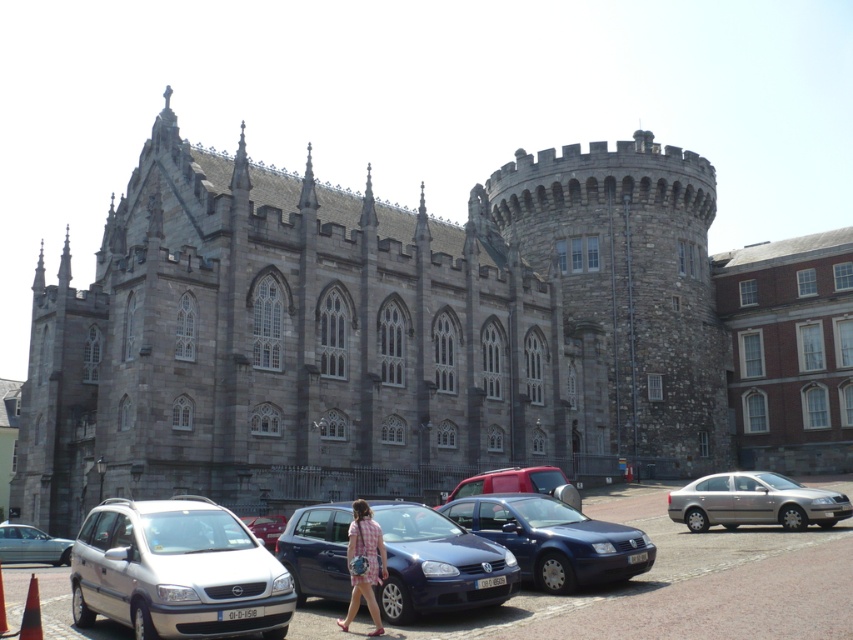
Question: Which point is closer to the camera?

Choices:
 (A) (44, 536)
 (B) (366, 557)

Answer: (B)

Question: Is matte red car at center thinner than metallic silver van at center?

Choices:
 (A) no
 (B) yes

Answer: (A)

Question: In this image, where is white matte van at lower left located relative to silver metallic sedan at lower left?

Choices:
 (A) right
 (B) left

Answer: (A)

Question: Which point is farther from the camera taking this photo?

Choices:
 (A) (265, 525)
 (B) (164, 502)
 (C) (795, 508)

Answer: (A)

Question: Is metallic blue sedan at center smaller than pink plaid dress at center?

Choices:
 (A) yes
 (B) no

Answer: (A)

Question: Which object appears farthest from the camera in this image?

Choices:
 (A) pink plaid dress at center
 (B) matte red car at center

Answer: (B)